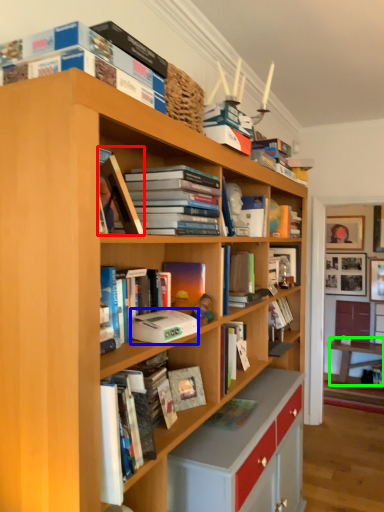
Question: Considering the real-world distances, which object is closest to book (highlighted by a red box)? paperback book (highlighted by a blue box) or table (highlighted by a green box).

Choices:
 (A) paperback book
 (B) table

Answer: (A)